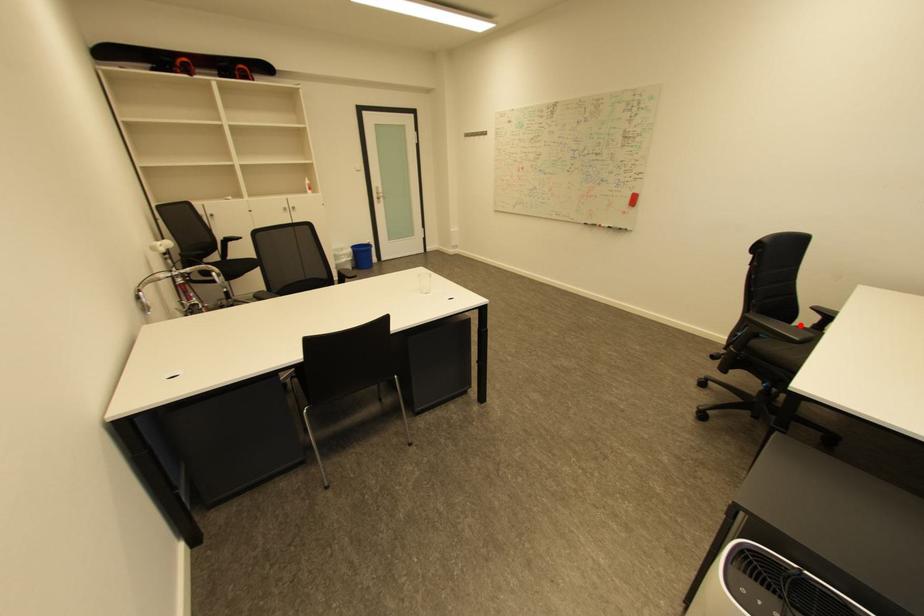
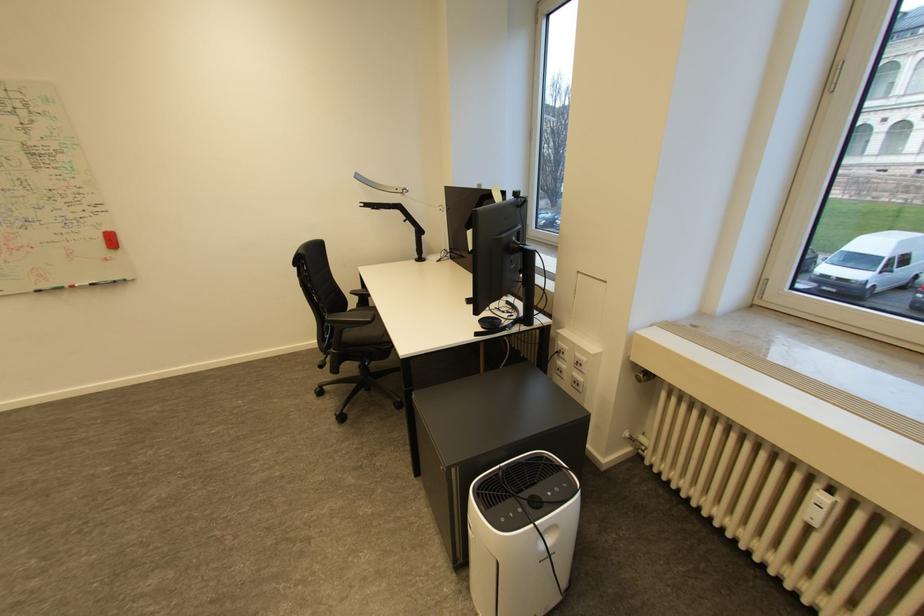
The point at the highlighted location is marked in the first image. Where is the corresponding point in the second image?

(355, 310)